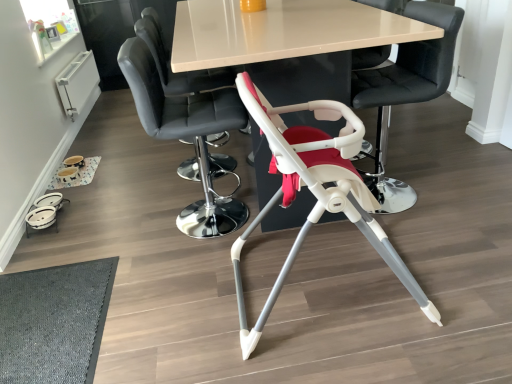
Image resolution: width=512 pixels, height=384 pixels. Find the location of `free space in front of smooth leather chair at upper center, which is the first chair in left-to-right order`. free space in front of smooth leather chair at upper center, which is the first chair in left-to-right order is located at coordinates (180, 193).